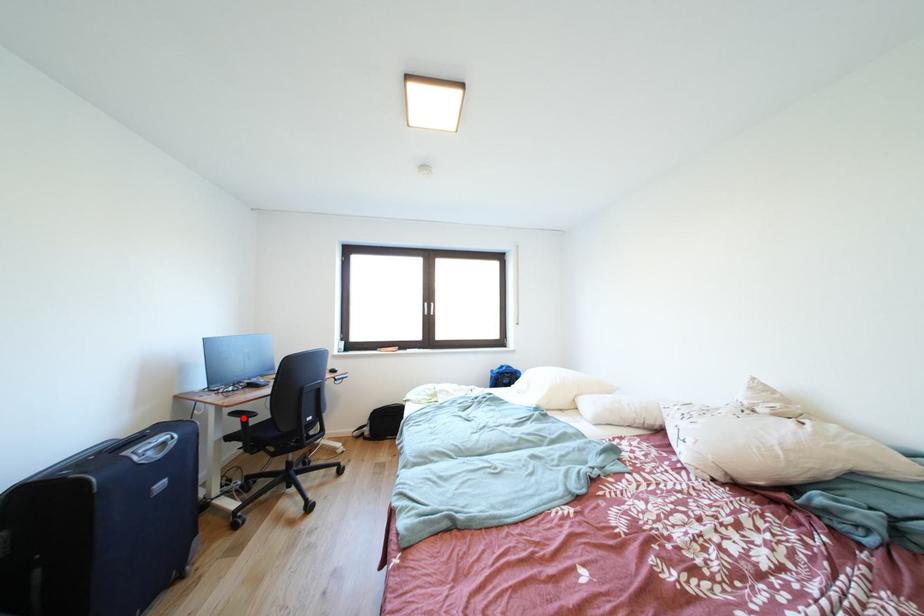
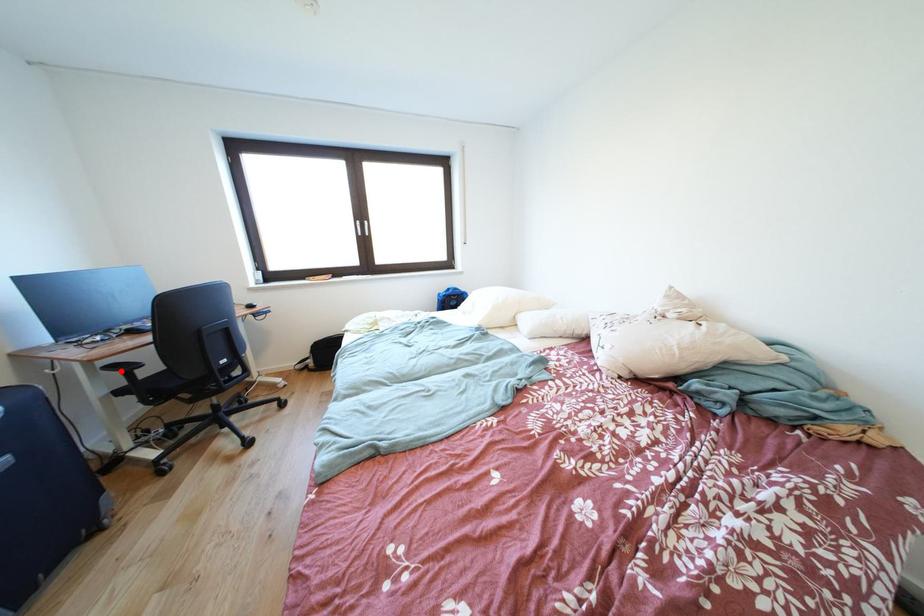
I am providing you with two images of the same scene from different viewpoints. A red point is marked on the first image and another point is marked on the second image. Do the highlighted points in image1 and image2 indicate the same real-world spot?

Yes